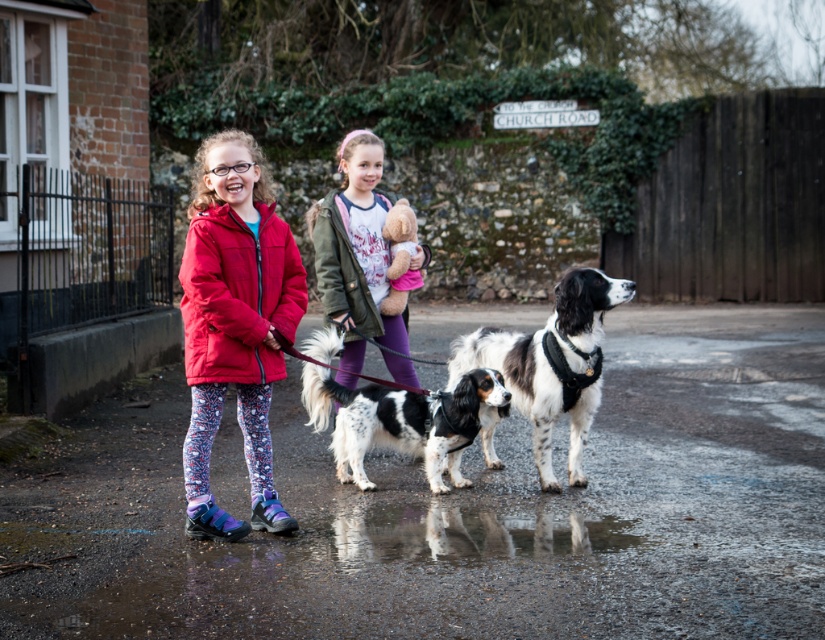
Question: Which object appears farthest from the camera in this image?

Choices:
 (A) spotted fur dog at center
 (B) glossy reflective puddle at lower center
 (C) matte red jacket at center

Answer: (A)

Question: Can you confirm if matte red jacket at center is smaller than matte green jacket at center?

Choices:
 (A) yes
 (B) no

Answer: (B)

Question: Which is farther from the matte green jacket at center?

Choices:
 (A) matte red jacket at center
 (B) black and white fur at center
 (C) glossy reflective puddle at lower center

Answer: (C)

Question: Can you confirm if matte green jacket at center is thinner than glossy reflective puddle at lower center?

Choices:
 (A) no
 (B) yes

Answer: (B)

Question: Which of these objects is positioned closest to the matte red jacket at center?

Choices:
 (A) glossy reflective puddle at lower center
 (B) spotted fur dog at center
 (C) matte green jacket at center

Answer: (B)

Question: Is spotted fur dog at center thinner than glossy reflective puddle at lower center?

Choices:
 (A) no
 (B) yes

Answer: (B)